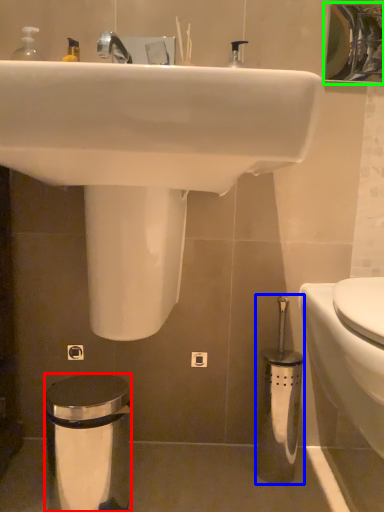
Question: Considering the real-world distances, which object is closest to trash bin/can (highlighted by a red box)? brush (highlighted by a blue box) or mirror (highlighted by a green box).

Choices:
 (A) brush
 (B) mirror

Answer: (A)